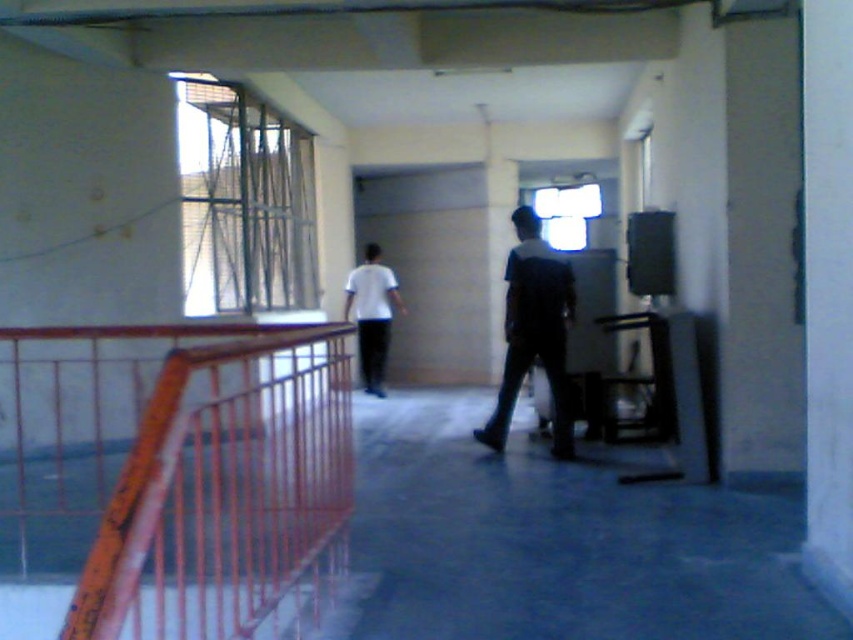
Question: Based on their relative distances, which object is nearer to the white matte shirt at center?

Choices:
 (A) orange painted metal railing at left
 (B) dark blue fabric shirt at center

Answer: (B)

Question: Is the position of orange painted metal railing at left less distant than that of white matte shirt at center?

Choices:
 (A) no
 (B) yes

Answer: (B)

Question: Does dark blue fabric shirt at center have a larger size compared to white matte shirt at center?

Choices:
 (A) yes
 (B) no

Answer: (A)

Question: Which point appears closest to the camera in this image?

Choices:
 (A) (379, 330)
 (B) (122, 368)
 (C) (554, 339)

Answer: (C)

Question: Does orange painted metal railing at left appear under white matte shirt at center?

Choices:
 (A) yes
 (B) no

Answer: (A)

Question: Which point is farther from the camera taking this photo?

Choices:
 (A) coord(126,532)
 (B) coord(358,298)
 (C) coord(555,440)

Answer: (B)